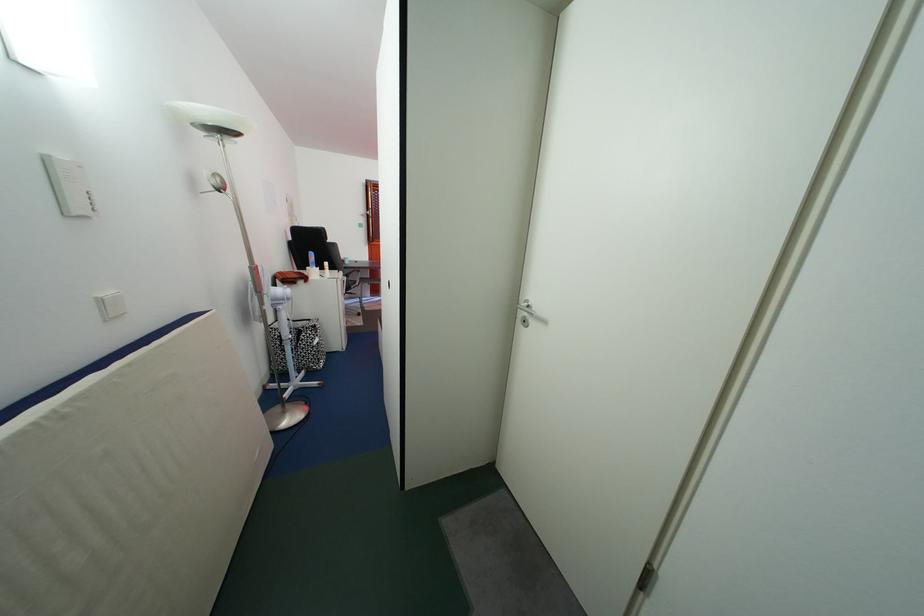
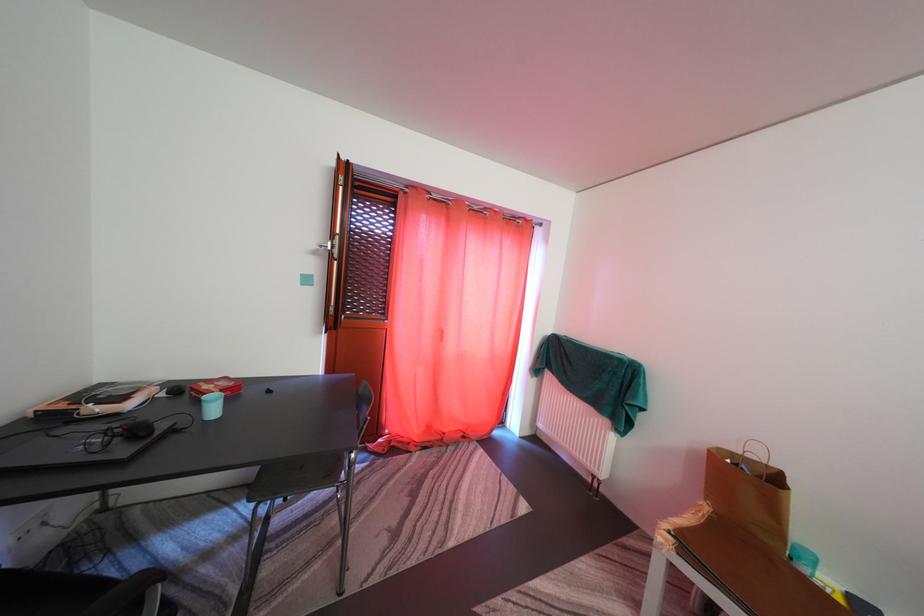
Question: What movement of the cameraman would produce the second image?

Choices:
 (A) Left
 (B) Right
 (C) Forward
 (D) Backward

Answer: (C)